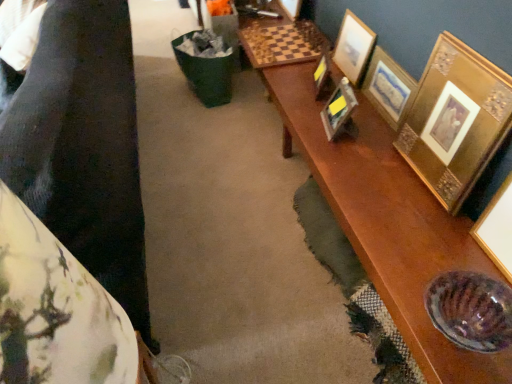
Question: From a real-world perspective, relative to gold ornate picture frame at right, the fifth picture frame positioned from the left, is gold textured frame at upper right, positioned as the third picture frame in left-to-right order, vertically above or below?

Choices:
 (A) above
 (B) below

Answer: (B)

Question: In terms of height, does gold textured frame at upper right, acting as the third picture frame starting from the right, look taller or shorter compared to gold ornate picture frame at right, the fifth picture frame positioned from the left?

Choices:
 (A) tall
 (B) short

Answer: (B)

Question: Estimate the real-world distances between objects in this image. Which object is closer to the gold textured frame at upper right, acting as the third picture frame starting from the right?

Choices:
 (A) gold textured picture frame at upper right, which is the 2th picture frame from right to left
 (B) metallic gold picture frame at center, acting as the 4th picture frame starting from the right
 (C) gold metallic picture frame at upper right, the 1th picture frame from the left
 (D) fluffy fabric cushion at left
 (E) gold ornate picture frame at right, the fifth picture frame positioned from the left

Answer: (C)

Question: Estimate the real-world distances between objects in this image. Which object is farther from the gold metallic picture frame at upper right, the 1th picture frame from the left?

Choices:
 (A) gold ornate picture frame at right, the fifth picture frame positioned from the left
 (B) metallic gold picture frame at center, acting as the 4th picture frame starting from the right
 (C) gold textured frame at upper right, acting as the third picture frame starting from the right
 (D) fluffy fabric cushion at left
 (E) gold textured picture frame at upper right, placed as the 4th picture frame when sorted from left to right

Answer: (D)